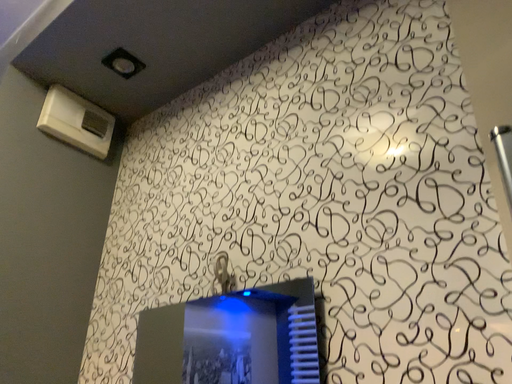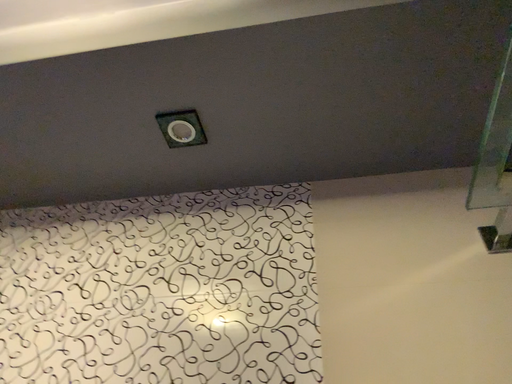
Question: How did the camera likely rotate when shooting the video?

Choices:
 (A) rotated downward
 (B) rotated upward

Answer: (B)